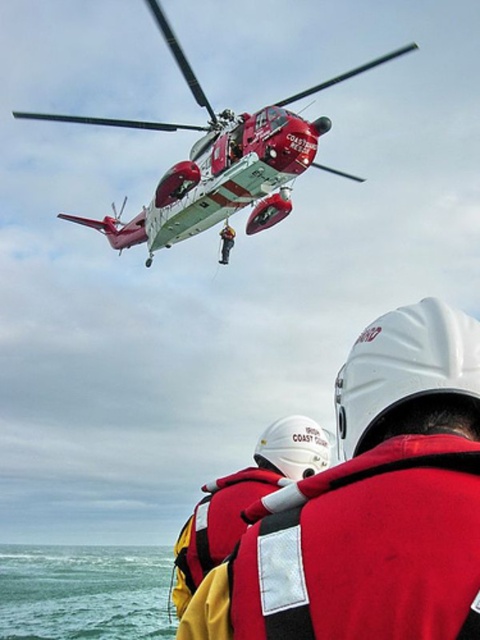
You are a drone operator trying to locate the white hard hat at upper center. The helicopter is at point (371, 504). What is the direction of the white hard hat at upper center relative to the helicopter?

The point corresponding to the white hard hat at upper center is at (371, 504), which is the same as the helicopter, so they are at the same location.

You are a safety inspector assessing the rescue operation. You notice the white hard hat at upper center and a camera in the scene. According to safety regulations, the minimum safe distance between such equipment should be at least 10 meters to avoid interference. Is the current distance compliant with the regulation?

The white hard hat at upper center and camera are 8.54 meters apart from each other, which is less than the required 10 meters. Therefore, the current distance does not comply with the safety regulation.